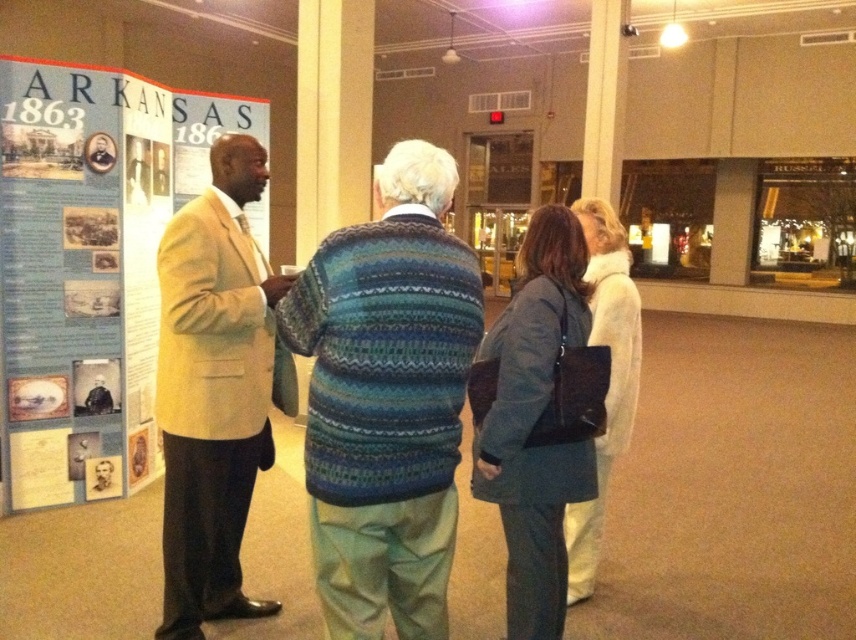
Question: Does matte yellow suit at left lie in front of dark gray fabric coat at center?

Choices:
 (A) no
 (B) yes

Answer: (A)

Question: Among these points, which one is nearest to the camera?

Choices:
 (A) (266, 116)
 (B) (171, 564)

Answer: (B)

Question: Which point appears farthest from the camera in this image?

Choices:
 (A) (18, 500)
 (B) (572, 579)
 (C) (381, 388)

Answer: (A)

Question: Which of the following is the farthest from the observer?

Choices:
 (A) white fuzzy coat at center
 (B) matte yellow suit at left
 (C) dark gray fabric coat at center

Answer: (B)

Question: Can you confirm if knitted sweater at center is thinner than matte yellow suit at left?

Choices:
 (A) yes
 (B) no

Answer: (B)

Question: Can you confirm if knitted sweater at center is bigger than matte yellow suit at left?

Choices:
 (A) yes
 (B) no

Answer: (B)